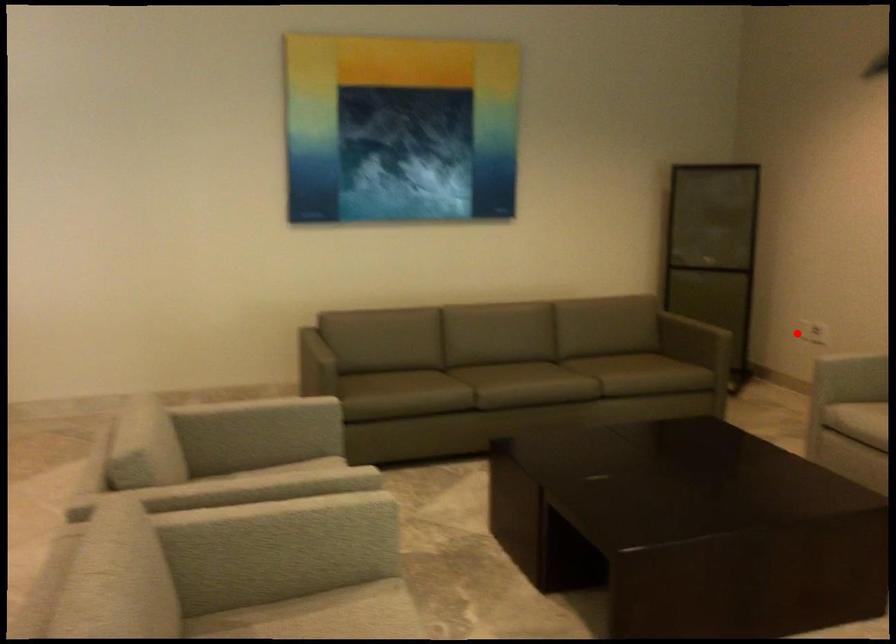
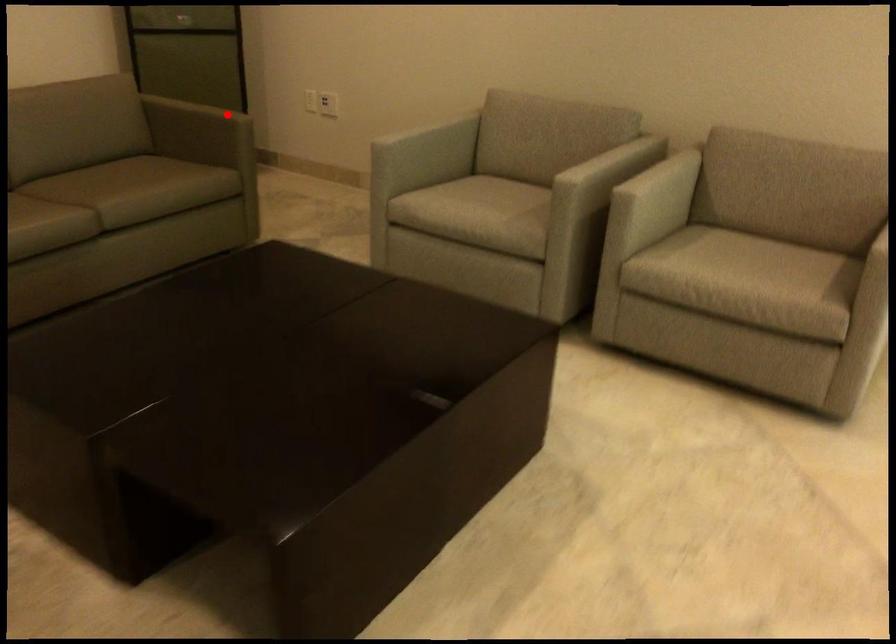
I am providing you with two images of the same scene from different viewpoints. A red point is marked on the first image and another point is marked on the second image. Is the red point in image1 aligned with the point shown in image2?

No